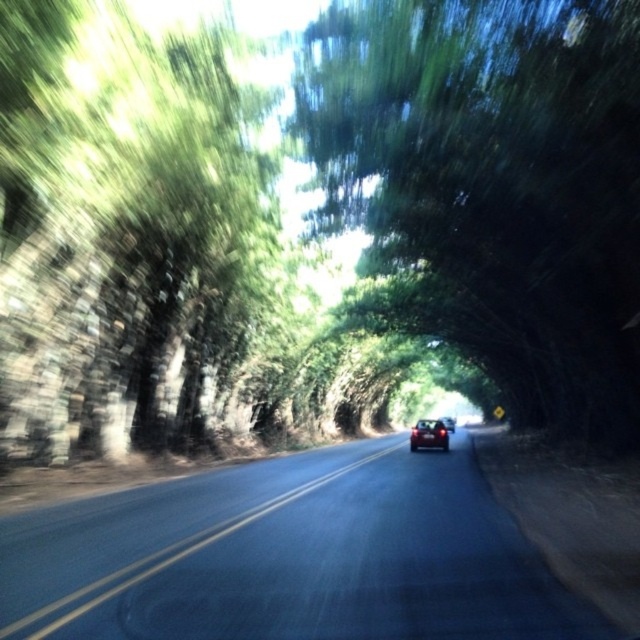
Does point (525, 132) lie in front of point (420, 436)?

Yes, point (525, 132) is closer to viewer.

Is green leafy tree at center wider than satin black car at center?

No, green leafy tree at center is not wider than satin black car at center.

Does point (397, 67) come farther from viewer compared to point (417, 440)?

No, it is not.

This screenshot has height=640, width=640. I want to click on green leafy tree at center, so click(492, 188).

Between point (120, 518) and point (419, 426), which one is positioned in front?

Positioned in front is point (120, 518).

Based on the photo, is asphalt road at center to the right of satin black car at center from the viewer's perspective?

No, asphalt road at center is not to the right of satin black car at center.

Find the location of a particular element. The image size is (640, 640). asphalt road at center is located at coordinates (289, 556).

Who is higher up, asphalt road at center or glossy red car at center?

asphalt road at center is above.

Does asphalt road at center come behind glossy red car at center?

That is False.

Does point (141, 497) come in front of point (449, 417)?

That is True.

Image resolution: width=640 pixels, height=640 pixels. I want to click on asphalt road at center, so click(x=289, y=556).